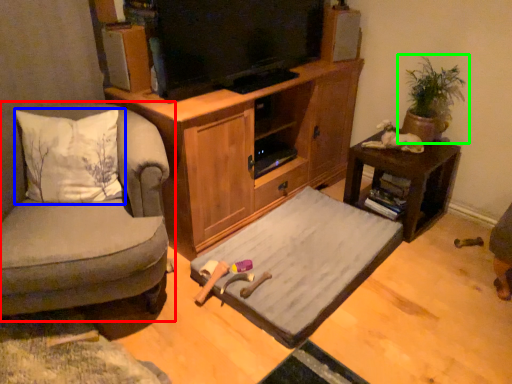
Question: Estimate the real-world distances between objects in this image. Which object is farther from chair (highlighted by a red box), pillow (highlighted by a blue box) or houseplant (highlighted by a green box)?

Choices:
 (A) pillow
 (B) houseplant

Answer: (B)